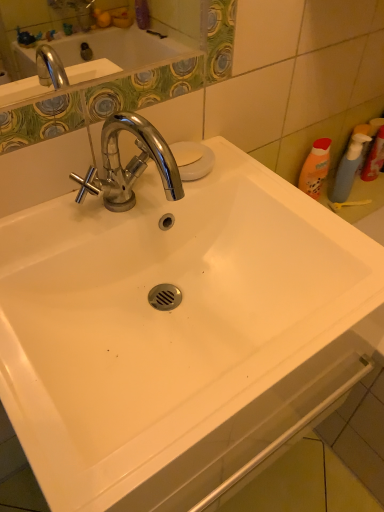
Question: From a real-world perspective, is white matte soap at upper center beneath translucent plastic spray bottle at right, which is the first cleaning product in right-to-left order?

Choices:
 (A) yes
 (B) no

Answer: (B)

Question: Considering the relative sizes of white matte soap at upper center and translucent plastic spray bottle at right, which is the first cleaning product in right-to-left order, in the image provided, is white matte soap at upper center thinner than translucent plastic spray bottle at right, which is the first cleaning product in right-to-left order,?

Choices:
 (A) yes
 (B) no

Answer: (B)

Question: Is white matte soap at upper center smaller than translucent plastic spray bottle at right, which is the first cleaning product in right-to-left order?

Choices:
 (A) no
 (B) yes

Answer: (B)

Question: Considering the relative positions of white matte soap at upper center and translucent plastic spray bottle at right, arranged as the second cleaning product when viewed from the left, in the image provided, is white matte soap at upper center in front of translucent plastic spray bottle at right, arranged as the second cleaning product when viewed from the left,?

Choices:
 (A) no
 (B) yes

Answer: (B)

Question: Is white matte soap at upper center not inside translucent plastic spray bottle at right, which is the first cleaning product in right-to-left order?

Choices:
 (A) no
 (B) yes

Answer: (B)

Question: Looking at the image, does translucent blue spray bottle at right, the first cleaning product from the left, seem bigger or smaller compared to translucent plastic spray bottle at right, arranged as the second cleaning product when viewed from the left?

Choices:
 (A) small
 (B) big

Answer: (A)

Question: In the image, is translucent blue spray bottle at right, the first cleaning product from the left, positioned in front of or behind translucent plastic spray bottle at right, which is the first cleaning product in right-to-left order?

Choices:
 (A) behind
 (B) front

Answer: (A)

Question: In the image, is translucent blue spray bottle at right, the first cleaning product from the left, on the left side or the right side of translucent plastic spray bottle at right, which is the first cleaning product in right-to-left order?

Choices:
 (A) right
 (B) left

Answer: (B)

Question: Does point (360, 152) appear closer or farther from the camera than point (372, 147)?

Choices:
 (A) farther
 (B) closer

Answer: (B)

Question: Is white matte soap at upper center to the left or to the right of translucent blue spray bottle at right, the first cleaning product from the left, in the image?

Choices:
 (A) left
 (B) right

Answer: (A)

Question: Is white matte soap at upper center wider or thinner than translucent blue spray bottle at right, the second cleaning product in the right-to-left sequence?

Choices:
 (A) wide
 (B) thin

Answer: (A)

Question: Relative to translucent blue spray bottle at right, the second cleaning product in the right-to-left sequence, is white matte soap at upper center in front or behind?

Choices:
 (A) behind
 (B) front

Answer: (B)

Question: Is white matte soap at upper center inside or outside of translucent blue spray bottle at right, the first cleaning product from the left?

Choices:
 (A) inside
 (B) outside

Answer: (B)

Question: From the image's perspective, relative to translucent blue spray bottle at right, the second cleaning product in the right-to-left sequence, is translucent plastic spray bottle at right, which is the first cleaning product in right-to-left order, above or below?

Choices:
 (A) above
 (B) below

Answer: (A)

Question: Considering the positions of translucent plastic spray bottle at right, arranged as the second cleaning product when viewed from the left, and translucent blue spray bottle at right, the first cleaning product from the left, in the image, is translucent plastic spray bottle at right, arranged as the second cleaning product when viewed from the left, taller or shorter than translucent blue spray bottle at right, the first cleaning product from the left,?

Choices:
 (A) tall
 (B) short

Answer: (A)